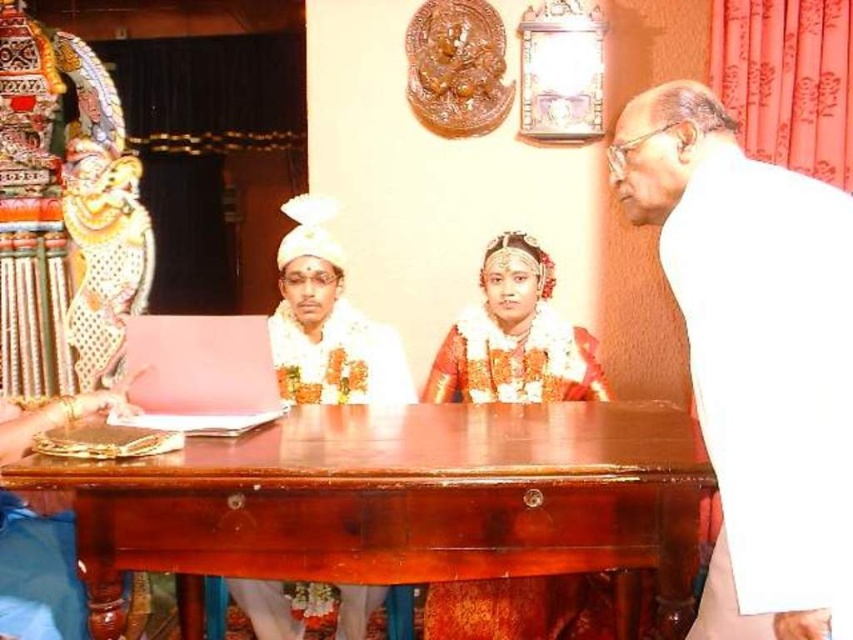
Is mahogany wood table at center thinner than white satin robe at center?

In fact, mahogany wood table at center might be wider than white satin robe at center.

Who is positioned more to the right, mahogany wood table at center or white satin robe at center?

From the viewer's perspective, mahogany wood table at center appears more on the right side.

Is point (495, 460) closer to camera compared to point (306, 390)?

That is True.

Image resolution: width=853 pixels, height=640 pixels. What are the coordinates of `mahogany wood table at center` in the screenshot? It's located at (398, 500).

Is white cloth at right closer to the viewer compared to golden textured saree at center?

Yes, white cloth at right is closer to the viewer.

Is white cloth at right wider than golden textured saree at center?

In fact, white cloth at right might be narrower than golden textured saree at center.

Describe the element at coordinates (753, 355) in the screenshot. I see `white cloth at right` at that location.

This screenshot has height=640, width=853. I want to click on white cloth at right, so click(753, 355).

Which of these two, mahogany wood table at center or golden textured saree at center, stands shorter?

With less height is mahogany wood table at center.

Who is lower down, mahogany wood table at center or golden textured saree at center?

mahogany wood table at center is lower down.

Locate an element on the screen. mahogany wood table at center is located at coordinates (398, 500).